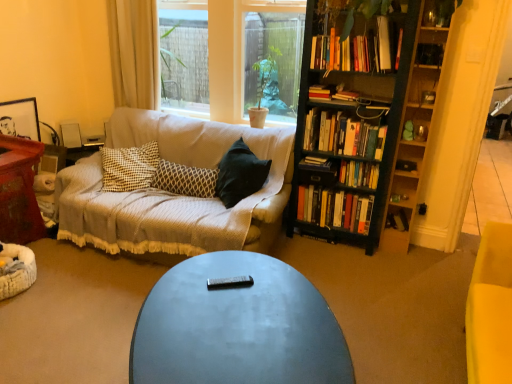
You are a GUI agent. You are given a task and a screenshot of the screen. Output one action in this format:
    pyautogui.click(x=<x>, y=<y>)
    Task: Click on the unoccupied region to the right of matte black coffee table at center
    The image size is (512, 384).
    Given the screenshot: What is the action you would take?
    pyautogui.click(x=396, y=331)